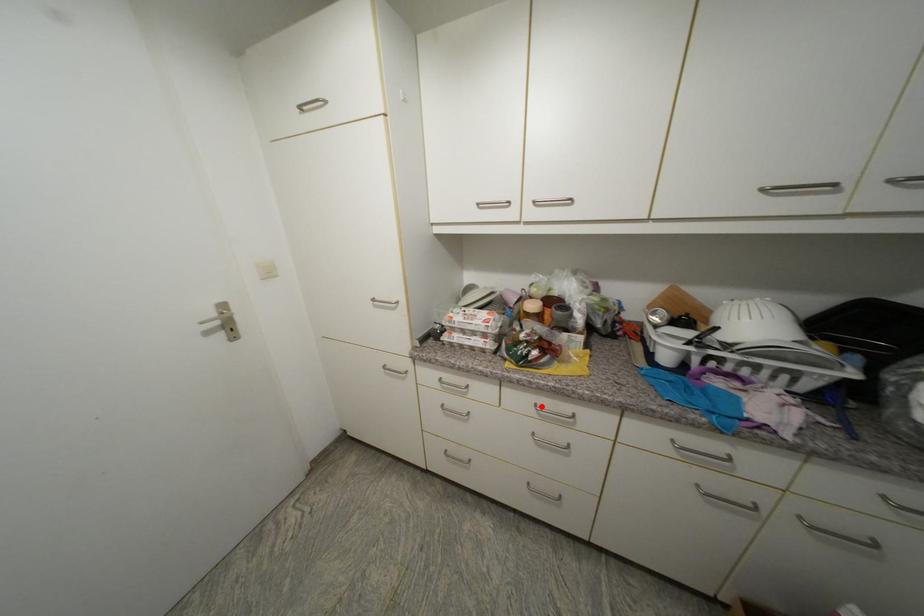
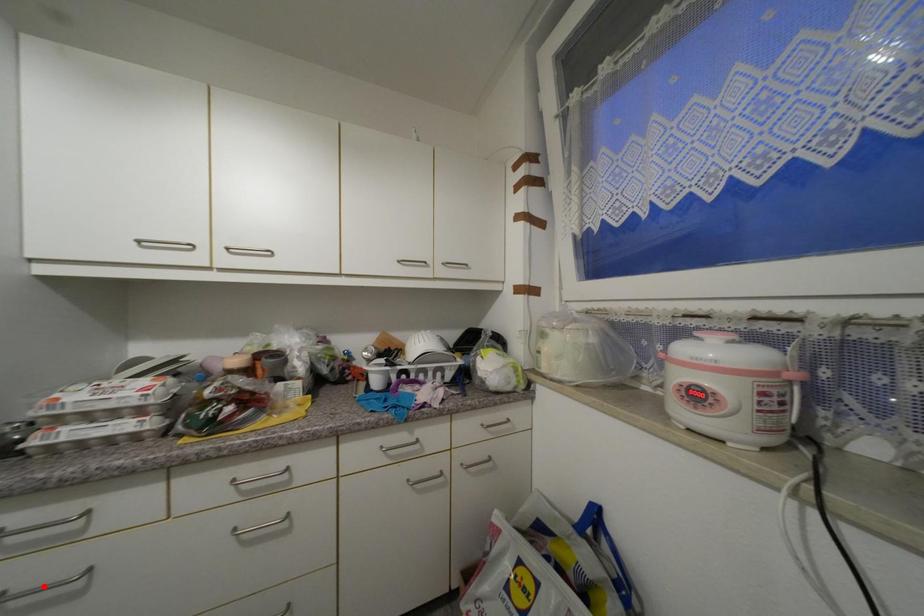
I am providing you with two images of the same scene from different viewpoints. A red point is marked on the first image and another point is marked on the second image. Is the red point in image1 aligned with the point shown in image2?

No